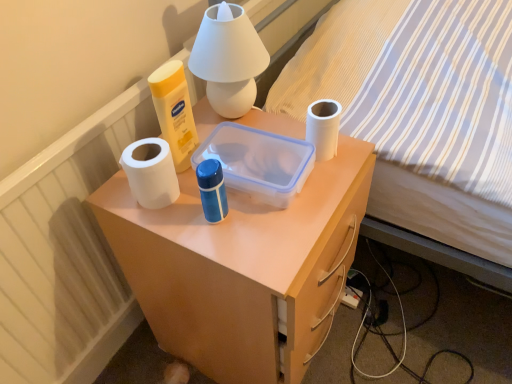
The height and width of the screenshot is (384, 512). I want to click on free location in front of white matte toilet paper at right, so click(310, 202).